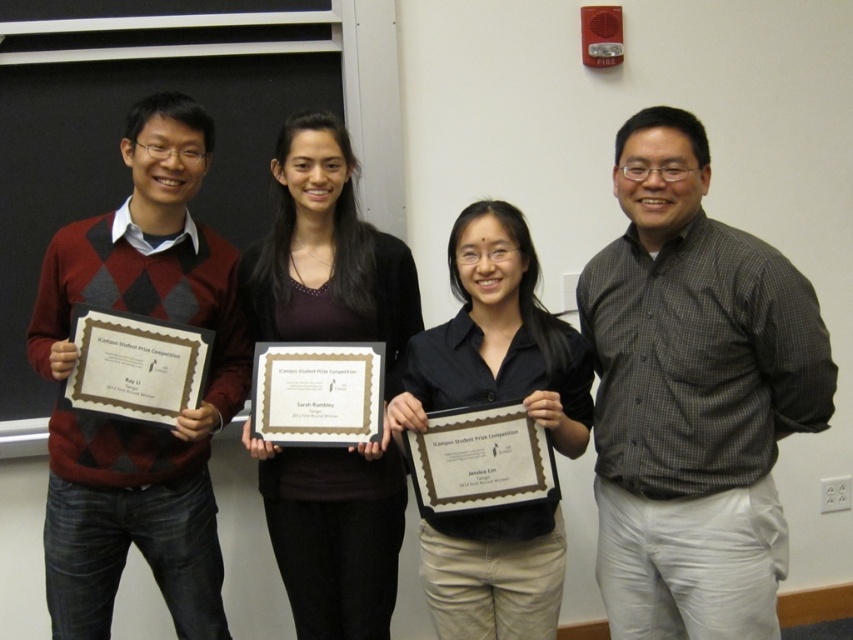
Does matte black plaque at center have a lesser height compared to gold paper certificate at center?

No.

Does point (479, 424) come in front of point (360, 346)?

Yes, it is.

Find the location of a particular element. matte black plaque at center is located at coordinates (480, 460).

Which of these two, matte gold certificate at left or gold paper certificate at center, stands shorter?

Standing shorter between the two is gold paper certificate at center.

Is point (85, 342) closer to camera compared to point (265, 376)?

That is True.

I want to click on matte gold certificate at left, so click(x=135, y=365).

Which of these two, gray checkered shirt at center or matte black certificate at left, stands taller?

With more height is matte black certificate at left.

Between point (722, 388) and point (230, 26), which one is positioned behind?

The point (230, 26) is behind.

Who is more forward, (x=688, y=433) or (x=254, y=33)?

Positioned in front is point (x=688, y=433).

The image size is (853, 640). What are the coordinates of `gray checkered shirt at center` in the screenshot? It's located at (693, 396).